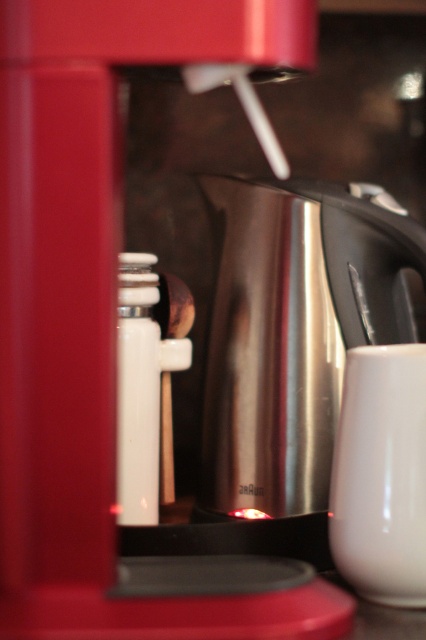
Question: Does stainless steel coffee pot at center have a greater width compared to white glossy mug at lower right?

Choices:
 (A) no
 (B) yes

Answer: (B)

Question: Among these objects, which one is farthest from the camera?

Choices:
 (A) stainless steel coffee pot at center
 (B) white glossy mug at lower right

Answer: (A)

Question: Among these objects, which one is farthest from the camera?

Choices:
 (A) white glossy mug at lower right
 (B) stainless steel coffee pot at center

Answer: (B)

Question: Which point appears closest to the camera in this image?

Choices:
 (A) (359, 536)
 (B) (321, 364)

Answer: (A)

Question: Where is stainless steel coffee pot at center located in relation to white glossy mug at lower right in the image?

Choices:
 (A) above
 (B) below

Answer: (A)

Question: Is the position of stainless steel coffee pot at center more distant than that of white glossy mug at lower right?

Choices:
 (A) yes
 (B) no

Answer: (A)